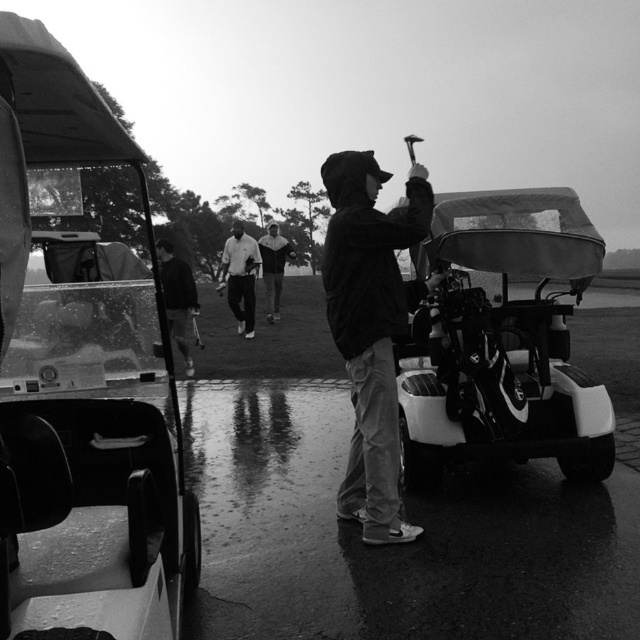
Does dark matte jacket at center have a lesser width compared to dark fabric jacket at left?

Indeed, dark matte jacket at center has a lesser width compared to dark fabric jacket at left.

Between point (352, 493) and point (168, 321), which one is positioned behind?

The point (168, 321) is behind.

Identify the location of dark matte jacket at center. Image resolution: width=640 pixels, height=640 pixels. (371, 328).

Which of these two, dark matte jacket at center or dark gray hoodie at center, stands shorter?

dark matte jacket at center

Which is behind, point (392, 461) or point (289, 257)?

Point (289, 257)

I want to click on dark matte jacket at center, so click(371, 328).

Which is in front, point (1, 417) or point (362, 211)?

Point (1, 417) is in front.

Looking at this image, does metallic golf cart at left appear over dark matte jacket at center?

Yes.

Does point (67, 96) come behind point (321, 260)?

That is False.

This screenshot has height=640, width=640. I want to click on metallic golf cart at left, so click(x=81, y=378).